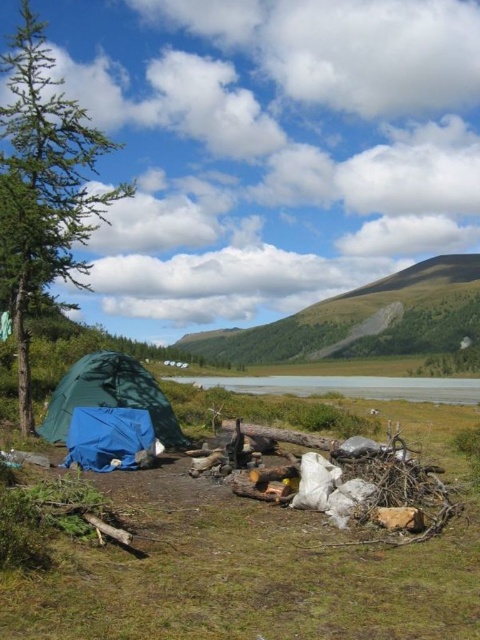
You are a hiker who needs to cross a stream. You see a transparent blue water at center and a blue tarp at lower left. Which object is taller and can help you determine the stream depth?

The transparent blue water at center has a greater height compared to the blue tarp at lower left, so the stream depth is deeper where the transparent blue water at center is located.